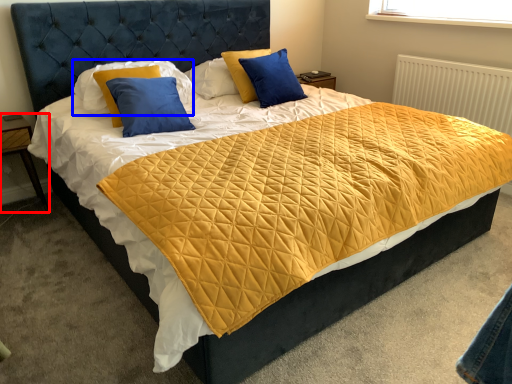
Question: Which of the following is the farthest to the observer, nightstand (highlighted by a red box) or pillow (highlighted by a blue box)?

Choices:
 (A) nightstand
 (B) pillow

Answer: (A)